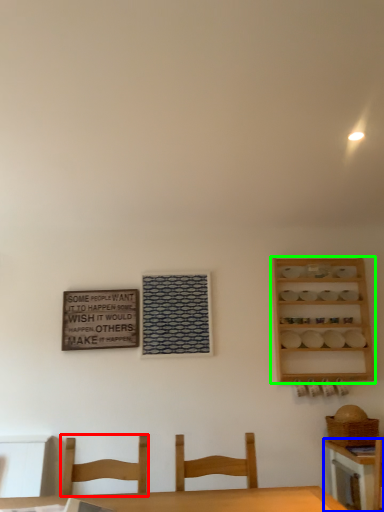
Question: Estimate the real-world distances between objects in this image. Which object is closer to chair (highlighted by a red box), table (highlighted by a blue box) or shelf (highlighted by a green box)?

Choices:
 (A) table
 (B) shelf

Answer: (A)